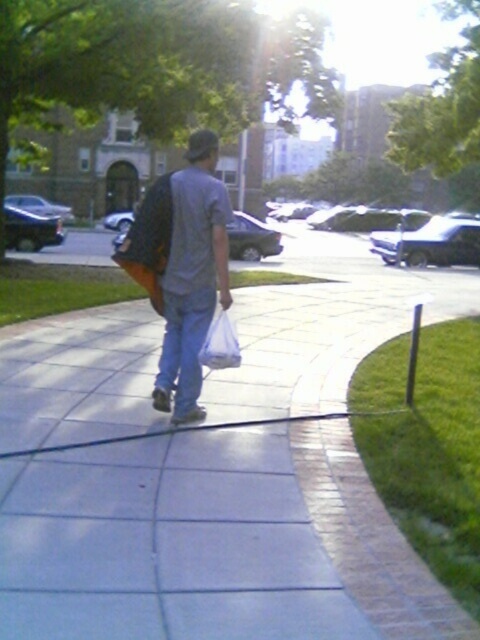
You are a photographer trying to capture the white concrete sidewalk at center and the white plastic bag at center in the same frame. Which object will appear larger in the photo?

The white concrete sidewalk at center will appear larger in the photo because it is taller than the white plastic bag at center.

You are standing at the camera position and want to walk towards the white concrete sidewalk at center. According to the coordinates provided, in which direction should you move relative to your current position?

The white concrete sidewalk at center is located at coordinates point [212,541]. Since the x and y coordinates are both greater than 0.5, you should move towards the upper right direction relative to your current position at the camera.

You are a photographer trying to capture the person in the scene. You want to focus on the matte gray shirt at center and the white plastic bag at center. Which object should you zoom in on to make sure it appears bigger in your photo?

The matte gray shirt at center is larger in size than the white plastic bag at center, so you should zoom in on the matte gray shirt at center to make it appear bigger in the photo.